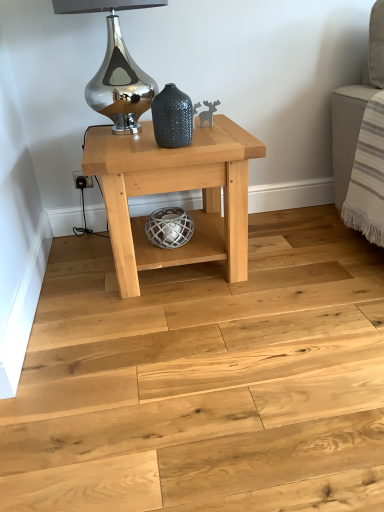
Question: Is point (162, 250) closer or farther from the camera than point (249, 399)?

Choices:
 (A) closer
 (B) farther

Answer: (B)

Question: Is natural wood table at center in front of or behind natural wood floor at center in the image?

Choices:
 (A) front
 (B) behind

Answer: (B)

Question: Which object is positioned closest to the shiny metallic table lamp at upper center?

Choices:
 (A) natural wood floor at center
 (B) natural wood table at center
 (C) textured dark gray vase at center

Answer: (B)

Question: Which object is positioned farthest from the textured dark gray vase at center?

Choices:
 (A) natural wood floor at center
 (B) natural wood table at center
 (C) shiny metallic table lamp at upper center

Answer: (A)